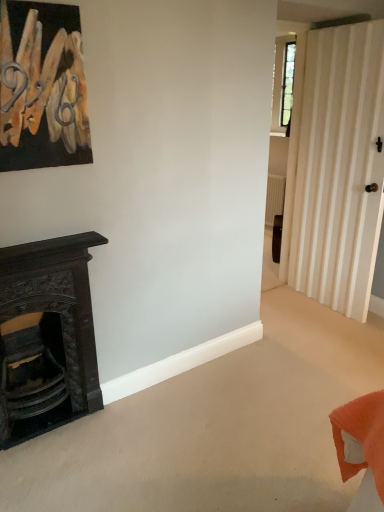
Locate an element on the screen. The width and height of the screenshot is (384, 512). black carved wood fireplace at lower left is located at coordinates (47, 337).

In order to face black carved wood fireplace at lower left, should I rotate leftwards or rightwards?

You should look left and rotate roughly 18.774 degrees.

The image size is (384, 512). What do you see at coordinates (47, 337) in the screenshot?
I see `black carved wood fireplace at lower left` at bounding box center [47, 337].

The width and height of the screenshot is (384, 512). I want to click on black carved wood fireplace at lower left, so click(47, 337).